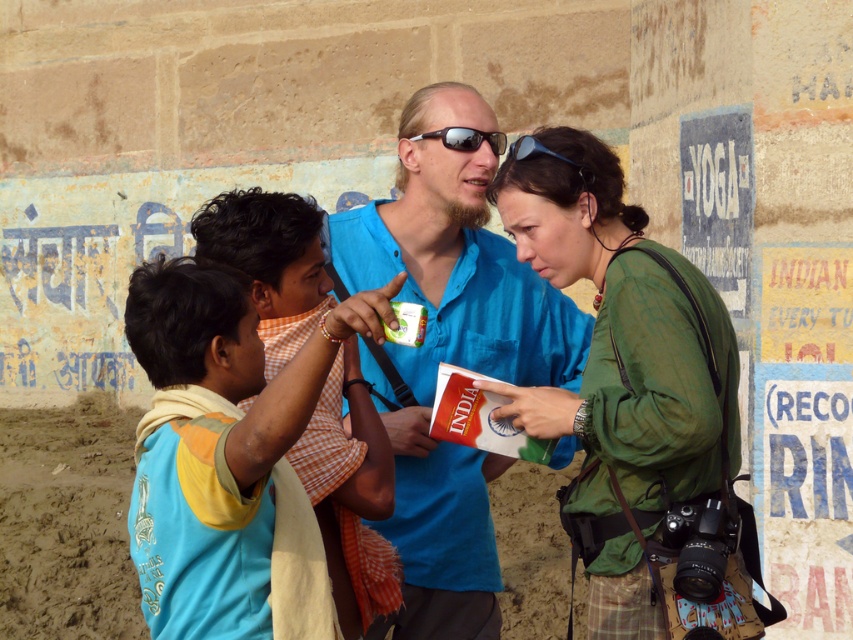
Question: Is blue cotton shirt at center positioned in front of sunglasses at center?

Choices:
 (A) yes
 (B) no

Answer: (A)

Question: From the image, what is the correct spatial relationship of blue cotton shirt at center in relation to green fabric shirt at center?

Choices:
 (A) right
 (B) left

Answer: (B)

Question: Considering the real-world distances, which object is closest to the sunglasses at center?

Choices:
 (A) blue cotton shirt at center
 (B) blue cotton shirt at lower left

Answer: (A)

Question: Which of the following is the farthest from the observer?

Choices:
 (A) green fabric shirt at center
 (B) blue cotton shirt at lower left

Answer: (A)

Question: Estimate the real-world distances between objects in this image. Which object is closer to the blue cotton shirt at center?

Choices:
 (A) sunglasses at center
 (B) blue cotton shirt at lower left
 (C) green fabric shirt at center

Answer: (C)

Question: From the image, what is the correct spatial relationship of blue cotton shirt at center in relation to green fabric shirt at center?

Choices:
 (A) right
 (B) left

Answer: (B)